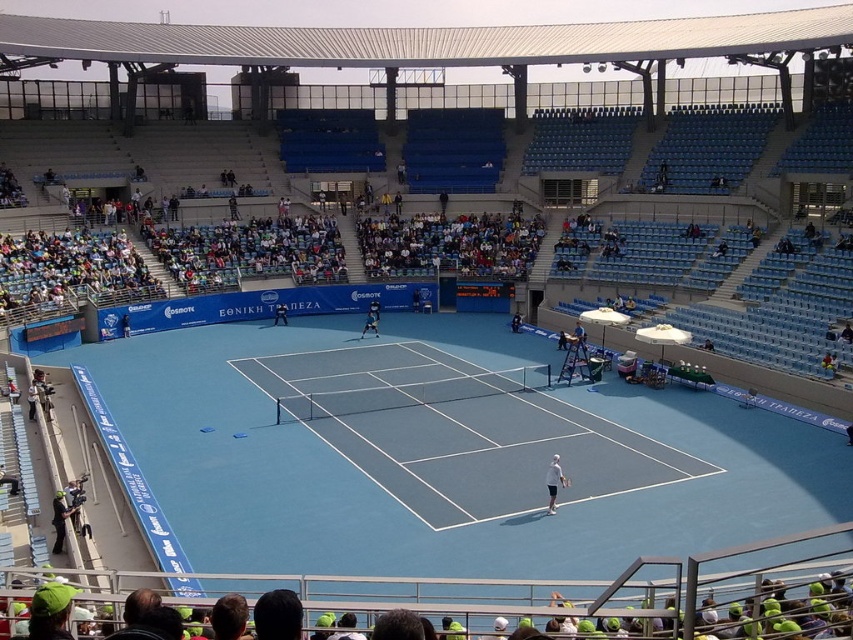
You are a photographer standing at the edge of the tennis court. You want to take a photo that includes both the white fabric umbrella at center and the dark gray suit at lower left. Can you fit both subjects into your camera frame if your camera has a maximum horizontal field of view of 7 meters?

The white fabric umbrella at center and dark gray suit at lower left are 7.16 meters apart. Since the distance between them exceeds the camera frame of 7 meters, you cannot fit both into the frame.

You are a spectator sitting in the stands watching the tennis match. You notice a white fabric umbrella at center and a dark gray suit at lower left. Which object is taller from your viewpoint?

The white fabric umbrella at center is taller than the dark gray suit at lower left.

In the scene shown: You are a photographer standing at the edge of the blue clay tennis court at center. You want to take a photo of the dark gray suit at lower left. Considering the width of both objects, which one would appear wider in the photo?

The blue clay tennis court at center appears wider in the photo because its width surpasses that of the dark gray suit at lower left.